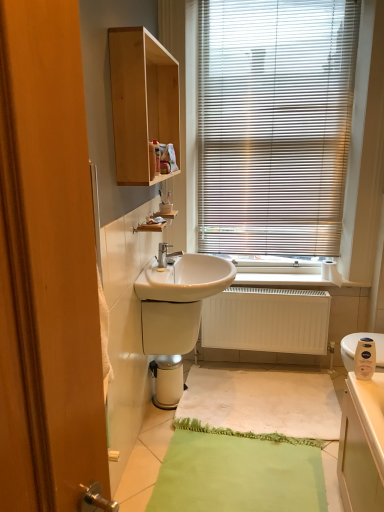
Find the location of a particular element. This screenshot has height=512, width=384. vacant area to the left of white matte toilet paper at right is located at coordinates (301, 279).